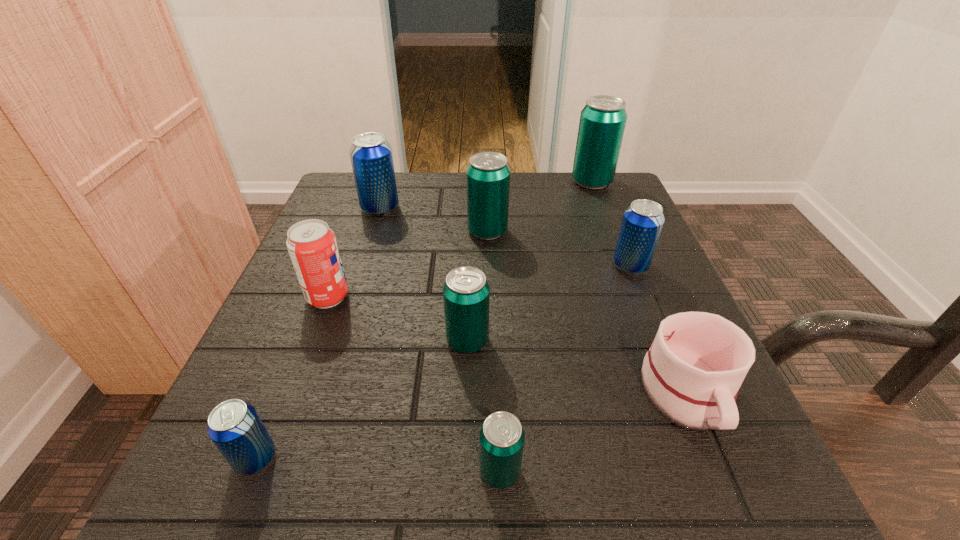
At what (x,y) coordinates should I click in order to perform the action: click on vacant space located 0.070m on the side with the handle of the mug. Please return your answer as a coordinate pair (x, y). Looking at the image, I should click on (732, 504).

The image size is (960, 540). I want to click on vacant space located on the right of the smallest blue beer can, so click(x=528, y=458).

This screenshot has height=540, width=960. What are the coordinates of `vacant space located 0.130m on the right of the smallest teal beer can` in the screenshot? It's located at (625, 471).

Where is `mug present at the near edge`? mug present at the near edge is located at coordinates (692, 373).

You are a GUI agent. You are given a task and a screenshot of the screen. Output one action in this format:
    pyautogui.click(x=<x>, y=<y>)
    Task: Click on the soda can that is at the left edge
    The image size is (960, 540).
    Given the screenshot: What is the action you would take?
    pyautogui.click(x=312, y=246)

Identify the location of mug at the right edge. (692, 373).

Locate an element on the screen. This screenshot has height=540, width=960. object that is positioned at the far left corner is located at coordinates (371, 157).

Where is `object located at the near left corner`? This screenshot has width=960, height=540. object located at the near left corner is located at coordinates (234, 426).

This screenshot has height=540, width=960. In order to click on object that is at the far right corner in this screenshot , I will do `click(602, 123)`.

I want to click on object that is at the near right corner, so click(692, 373).